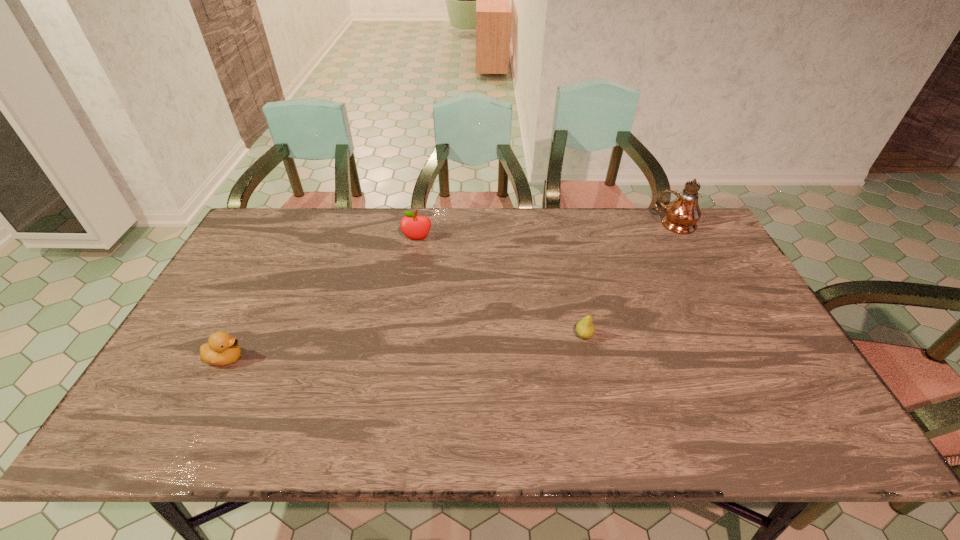
In the image, there is a desktop. Where is `blank space at the right edge`? The width and height of the screenshot is (960, 540). blank space at the right edge is located at coordinates (708, 271).

Locate an element on the screen. The width and height of the screenshot is (960, 540). vacant area at the far left corner is located at coordinates (280, 217).

Image resolution: width=960 pixels, height=540 pixels. Identify the location of free space at the far right corner of the desktop. (706, 229).

You are a GUI agent. You are given a task and a screenshot of the screen. Output one action in this format:
    pyautogui.click(x=<x>, y=<y>)
    Task: Click on the blank region between the third object from right to left and the oil lamp
    The image size is (960, 540).
    Given the screenshot: What is the action you would take?
    pyautogui.click(x=546, y=232)

Identify the location of empty location between the third farthest object and the duckling. The image size is (960, 540). (405, 347).

Find the location of `empty location between the apple and the leftmost object`. empty location between the apple and the leftmost object is located at coordinates (322, 299).

At what (x,y) coordinates should I click in order to perform the action: click on free space between the farthest object and the second object from right to left. Please return your answer as a coordinate pair (x, y). This screenshot has height=540, width=960. Looking at the image, I should click on (630, 280).

Where is `free spot between the pear and the rightmost object`? The height and width of the screenshot is (540, 960). free spot between the pear and the rightmost object is located at coordinates (630, 280).

Find the location of a particular element. The width and height of the screenshot is (960, 540). vacant space in between the rightmost object and the apple is located at coordinates (546, 232).

Where is `free spot between the third object from right to left and the rightmost object`? free spot between the third object from right to left and the rightmost object is located at coordinates tap(546, 232).